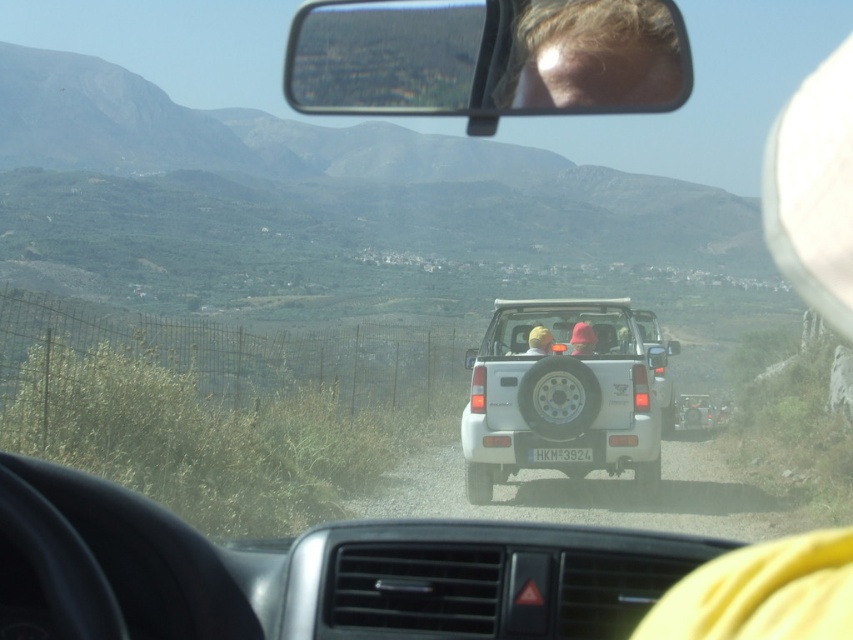
Question: Can you confirm if clear plastic view mirror at upper center is bigger than white matte pickup truck at center?

Choices:
 (A) no
 (B) yes

Answer: (A)

Question: Does clear plastic view mirror at upper center come in front of blonde hair at upper center?

Choices:
 (A) yes
 (B) no

Answer: (A)

Question: Among these objects, which one is farthest from the camera?

Choices:
 (A) yellow fabric headscarf at rear center
 (B) white matte pickup truck at center
 (C) white matte car window at center

Answer: (A)

Question: Which is farther from the white plastic license plate at rear?

Choices:
 (A) white matte pickup truck at center
 (B) matte red helmet at rear center
 (C) white matte car window at center

Answer: (A)

Question: Does white plastic license plate at rear have a greater width compared to yellow fabric headscarf at rear center?

Choices:
 (A) yes
 (B) no

Answer: (A)

Question: Which point is farther from the camera taking this photo?

Choices:
 (A) (379, 52)
 (B) (567, 348)
 (C) (665, 77)

Answer: (B)